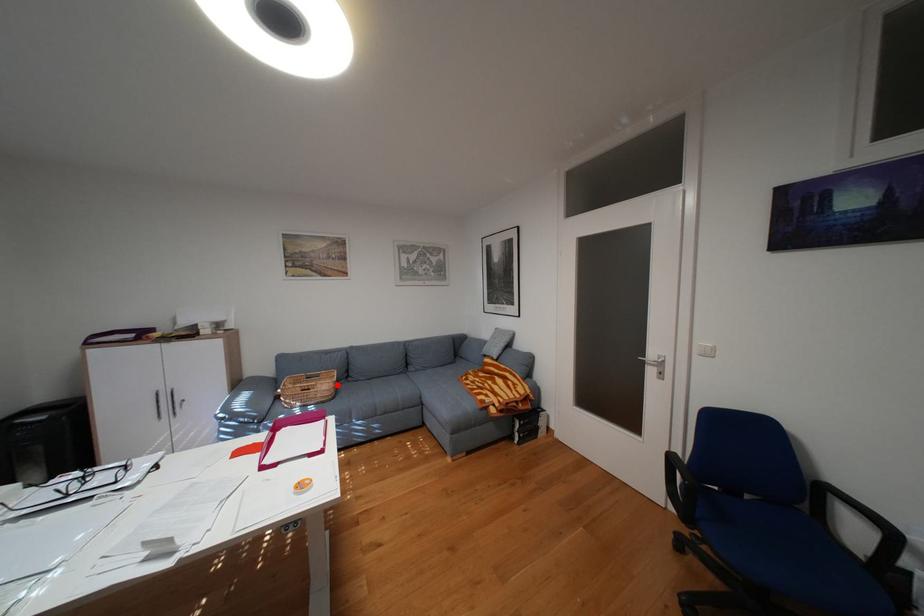
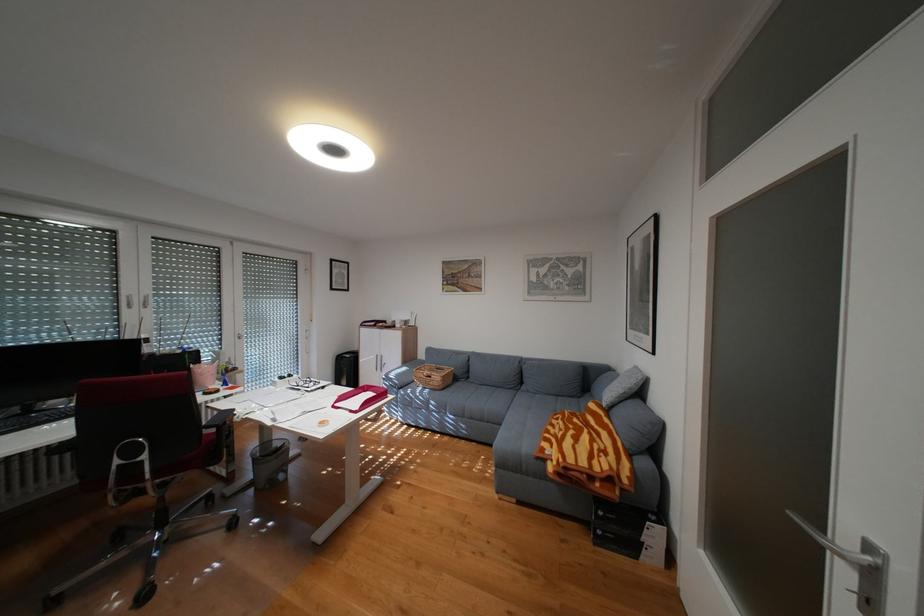
The point at the highlighted location is marked in the first image. Where is the corresponding point in the second image?

(450, 377)